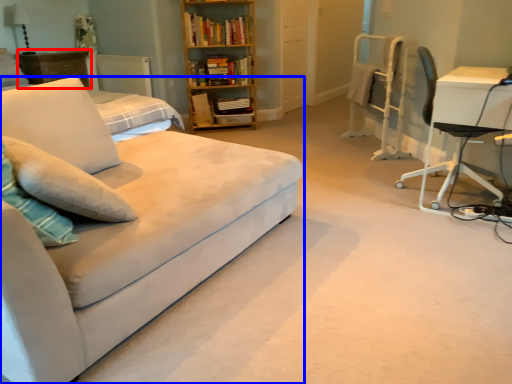
Question: Which object is further to the camera taking this photo, dresser (highlighted by a red box) or studio couch (highlighted by a blue box)?

Choices:
 (A) dresser
 (B) studio couch

Answer: (A)